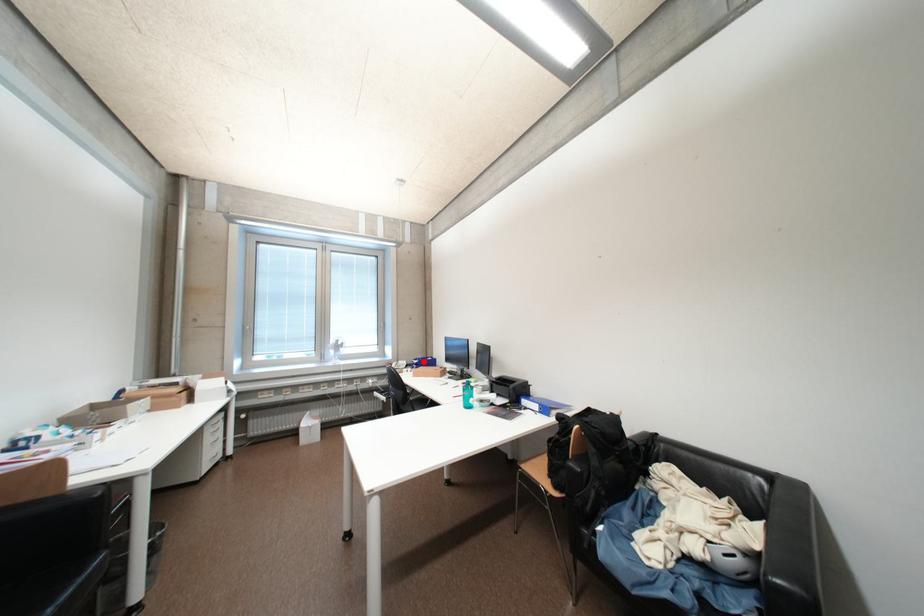
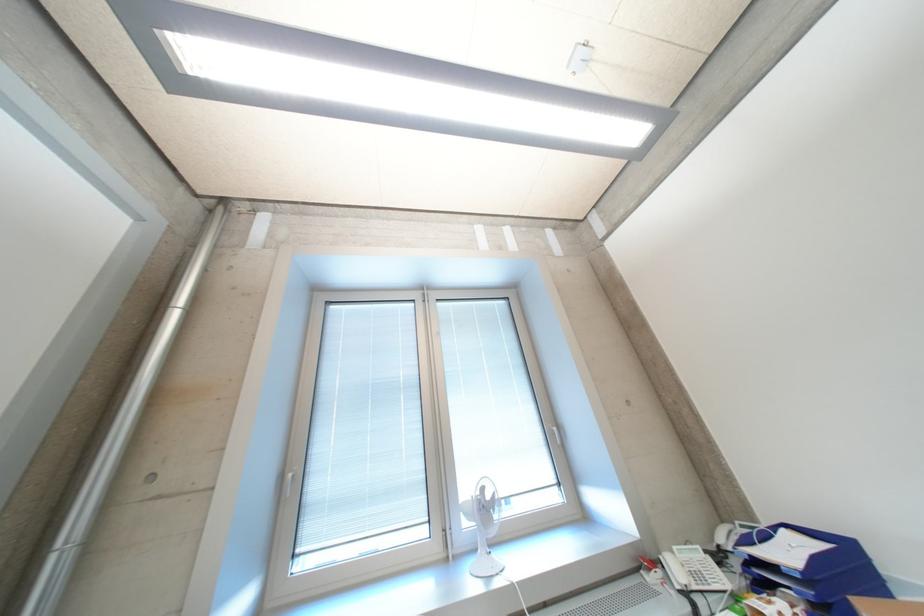
Question: I am providing you with two images of the same scene from different viewpoints. In image1, a red point is highlighted. Considering the same 3D point in image2, which of the following is correct?

Choices:
 (A) It is closer
 (B) It is farther

Answer: (A)